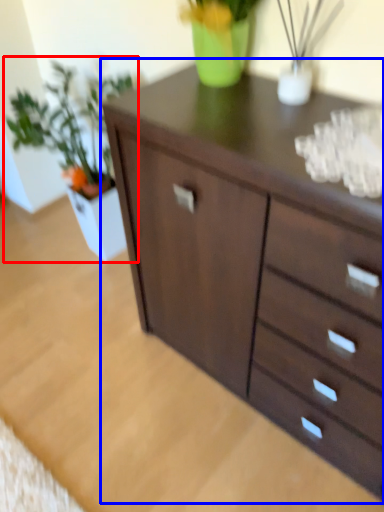
Question: Which point is closer to the camera, houseplant (highlighted by a red box) or chest of drawers (highlighted by a blue box)?

Choices:
 (A) houseplant
 (B) chest of drawers

Answer: (B)